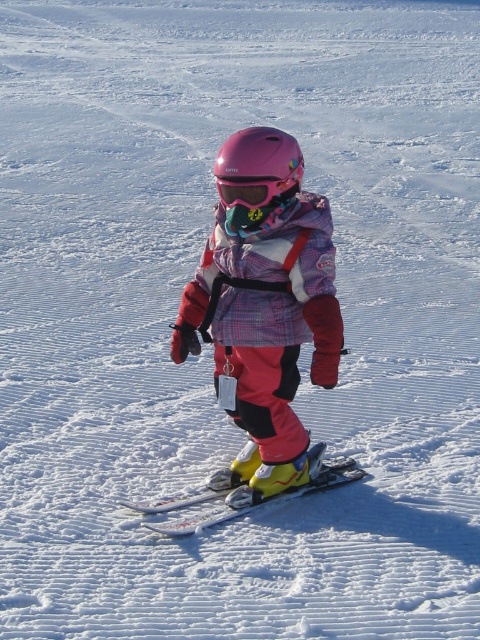
You are a photographer trying to capture the child in the scene. You notice the pink matte helmet at center and the yellow matte ski at center. Which object should you focus on first if you want to ensure both are in sharp focus?

The pink matte helmet at center is in front of the yellow matte ski at center, so focusing on the pink matte helmet at center first will ensure both are in sharp focus.